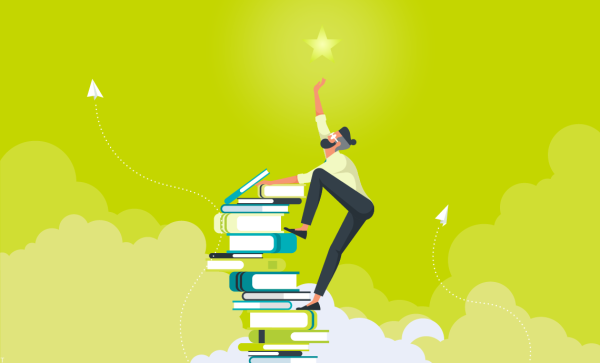
In order to click on green book in this screenshot , I will do `click(262, 267)`, `click(280, 320)`, `click(281, 335)`, `click(258, 348)`.